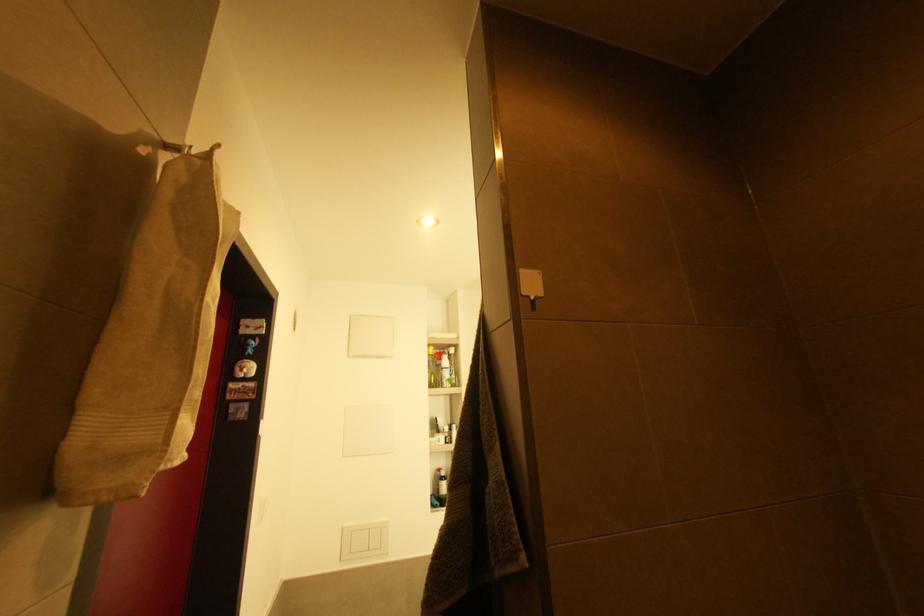
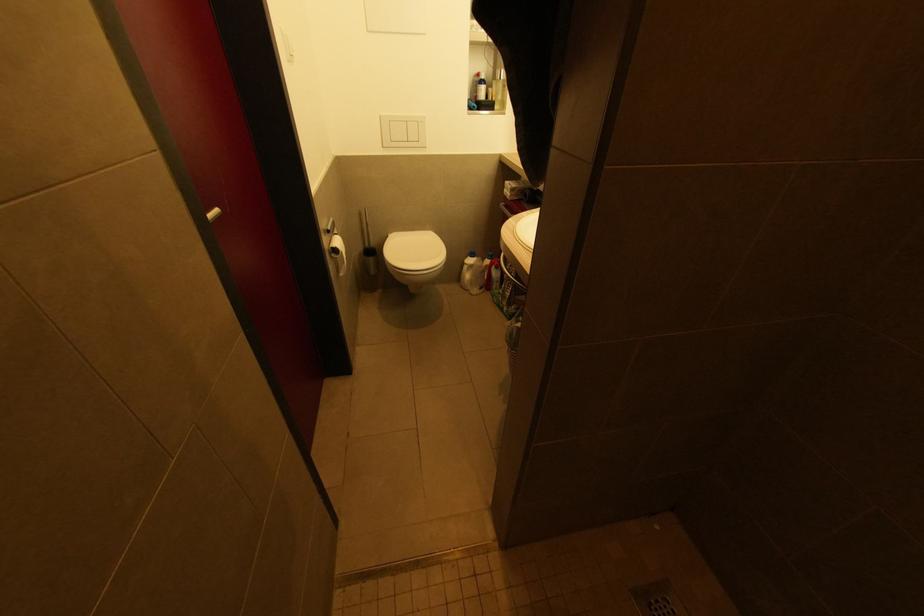
Question: The first image is from the beginning of the video and the second image is from the end. How did the camera likely rotate when shooting the video?

Choices:
 (A) Left
 (B) Right
 (C) Up
 (D) Down

Answer: (D)